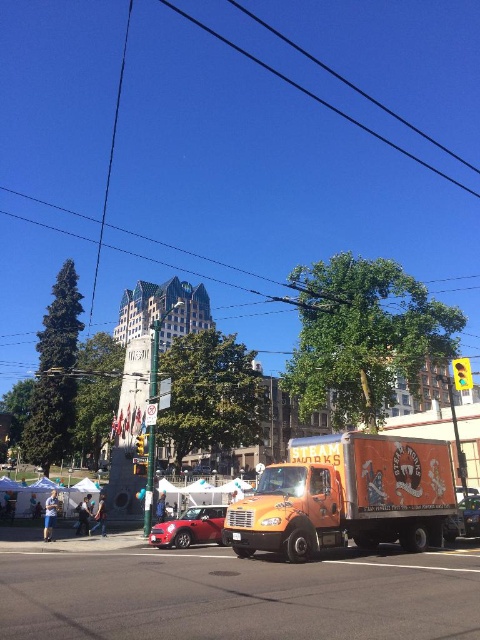
Between black wire at upper center and metallic silver car at center, which one is positioned lower?

metallic silver car at center is lower down.

The image size is (480, 640). What do you see at coordinates (315, 97) in the screenshot?
I see `black wire at upper center` at bounding box center [315, 97].

This screenshot has height=640, width=480. I want to click on black wire at upper center, so click(x=315, y=97).

Who is taller, shiny red car at center or metallic silver car at center?

shiny red car at center is taller.

Is point (186, 531) behind point (467, 502)?

That is False.

At what (x,y) coordinates should I click in order to perform the action: click on shiny red car at center. Please return your answer as a coordinate pair (x, y). Image resolution: width=480 pixels, height=640 pixels. Looking at the image, I should click on (190, 529).

The image size is (480, 640). What do you see at coordinates (347, 497) in the screenshot?
I see `orange matte food truck at center` at bounding box center [347, 497].

Measure the distance between orange matte food truck at center and camera.

They are 90.07 feet apart.

Is point (301, 552) farther from camera compared to point (263, 67)?

No, (301, 552) is in front of (263, 67).

In order to click on orange matte food truck at center in this screenshot , I will do `click(347, 497)`.